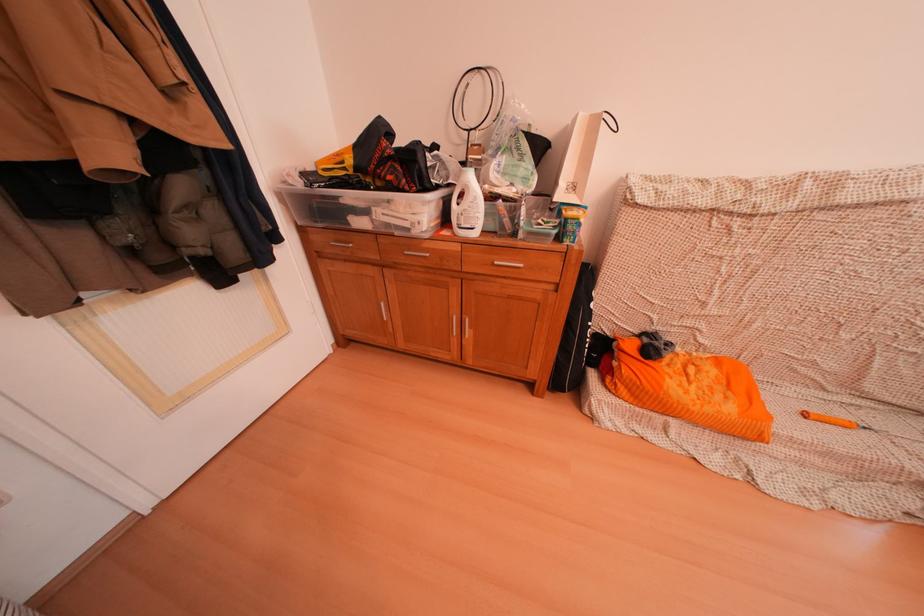
The height and width of the screenshot is (616, 924). I want to click on racket handle, so click(x=833, y=419).